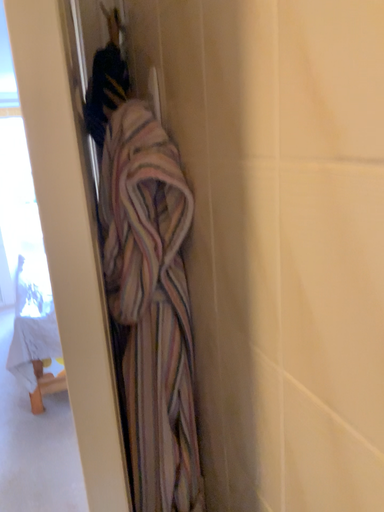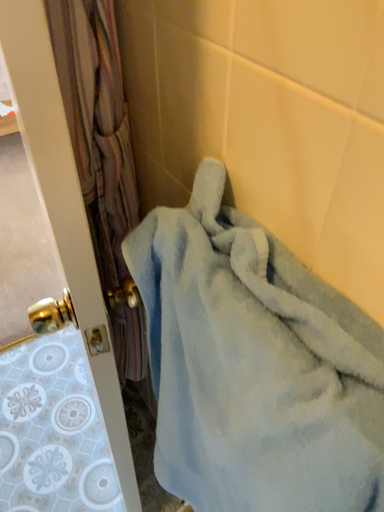
Question: How did the camera likely rotate when shooting the video?

Choices:
 (A) rotated upward
 (B) rotated downward

Answer: (B)